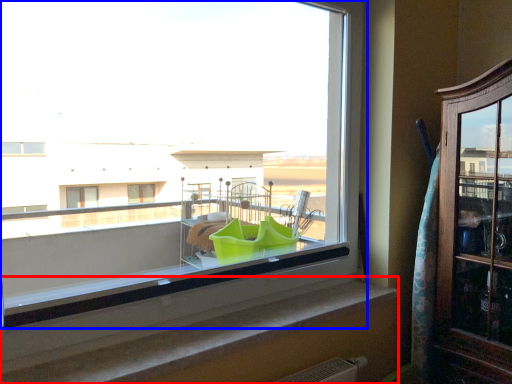
Question: Which object appears farthest to the camera in this image, window sill (highlighted by a red box) or window (highlighted by a blue box)?

Choices:
 (A) window sill
 (B) window

Answer: (A)